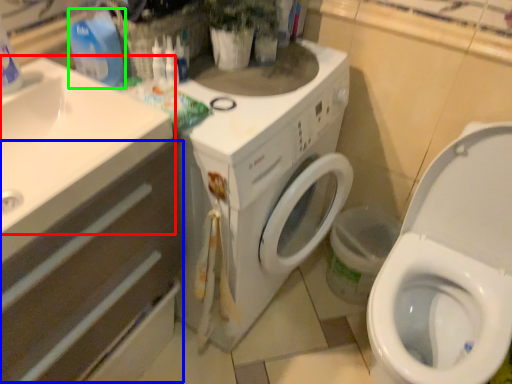
Question: Which object is the closest to the sink (highlighted by a red box)? Choose among these: drawer (highlighted by a blue box) or cleaning product (highlighted by a green box).

Choices:
 (A) drawer
 (B) cleaning product

Answer: (A)